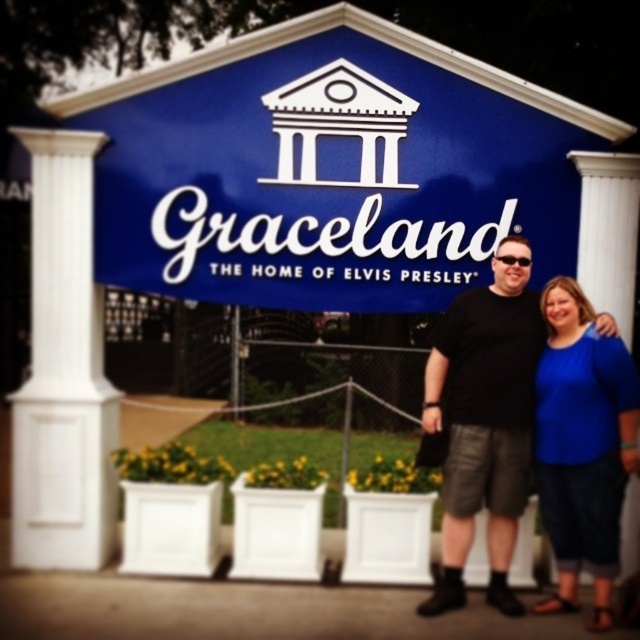
Question: Does blue painted sign at center appear over black matte shirt at center?

Choices:
 (A) no
 (B) yes

Answer: (B)

Question: From the image, what is the correct spatial relationship of white smooth column at left in relation to black matte shirt at center?

Choices:
 (A) left
 (B) right

Answer: (A)

Question: Which point is closer to the camera taking this photo?

Choices:
 (A) (540, 413)
 (B) (54, 241)
 (C) (301, 42)

Answer: (A)

Question: Does black matte shirt at center appear on the left side of blue fabric shirt at center?

Choices:
 (A) yes
 (B) no

Answer: (A)

Question: Among these objects, which one is nearest to the camera?

Choices:
 (A) black matte shirt at center
 (B) blue fabric shirt at center
 (C) blue painted sign at center
 (D) white smooth column at left

Answer: (B)

Question: Among these objects, which one is farthest from the camera?

Choices:
 (A) blue painted sign at center
 (B) blue fabric shirt at center

Answer: (A)